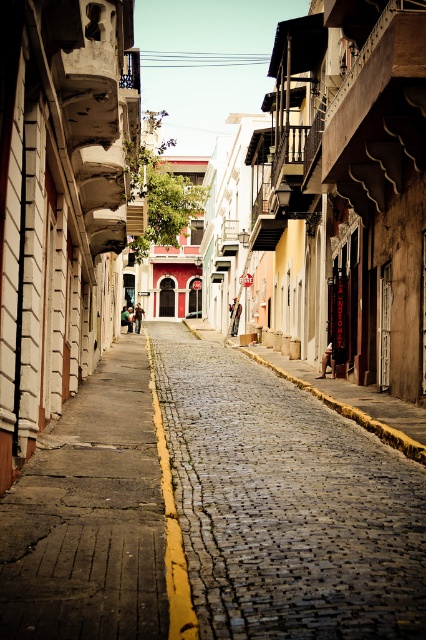
Question: Which point appears closest to the camera in this image?

Choices:
 (A) (2, 630)
 (B) (414, 625)

Answer: (A)

Question: In this image, where is cobblestone pavement at center located relative to concrete sidewalk at center?

Choices:
 (A) below
 (B) above

Answer: (A)

Question: Which object appears closest to the camera in this image?

Choices:
 (A) concrete sidewalk at center
 (B) cobblestone pavement at center

Answer: (A)

Question: Is cobblestone pavement at center thinner than concrete sidewalk at center?

Choices:
 (A) no
 (B) yes

Answer: (A)

Question: Does cobblestone pavement at center come in front of concrete sidewalk at center?

Choices:
 (A) yes
 (B) no

Answer: (B)

Question: Which point is farther to the camera?

Choices:
 (A) (127, 532)
 (B) (278, 596)

Answer: (A)